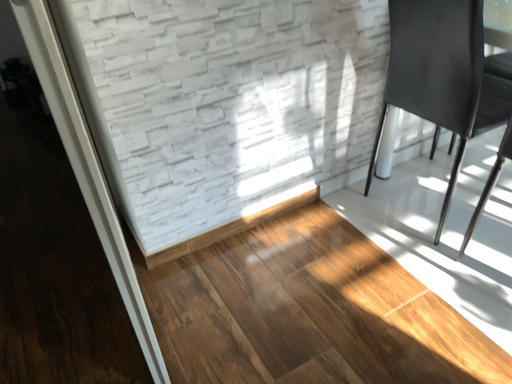
Question: Relative to matte black chair at right, is brown wood flooring at center in front or behind?

Choices:
 (A) front
 (B) behind

Answer: (A)

Question: Considering the positions of brown wood flooring at center and matte black chair at right in the image, is brown wood flooring at center wider or thinner than matte black chair at right?

Choices:
 (A) wide
 (B) thin

Answer: (A)

Question: Based on their sizes in the image, would you say brown wood flooring at center is bigger or smaller than matte black chair at right?

Choices:
 (A) big
 (B) small

Answer: (B)

Question: In the image, is matte black chair at right positioned in front of or behind brown wood flooring at center?

Choices:
 (A) front
 (B) behind

Answer: (B)

Question: From the image's perspective, relative to brown wood flooring at center, is matte black chair at right above or below?

Choices:
 (A) below
 (B) above

Answer: (B)

Question: Is matte black chair at right wider or thinner than brown wood flooring at center?

Choices:
 (A) thin
 (B) wide

Answer: (A)

Question: Do you think matte black chair at right is within brown wood flooring at center, or outside of it?

Choices:
 (A) outside
 (B) inside

Answer: (A)